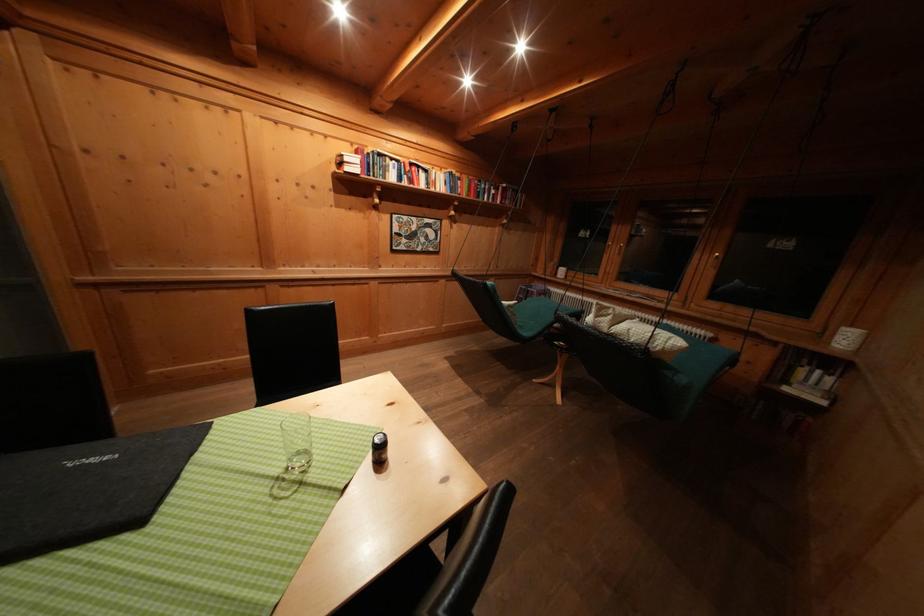
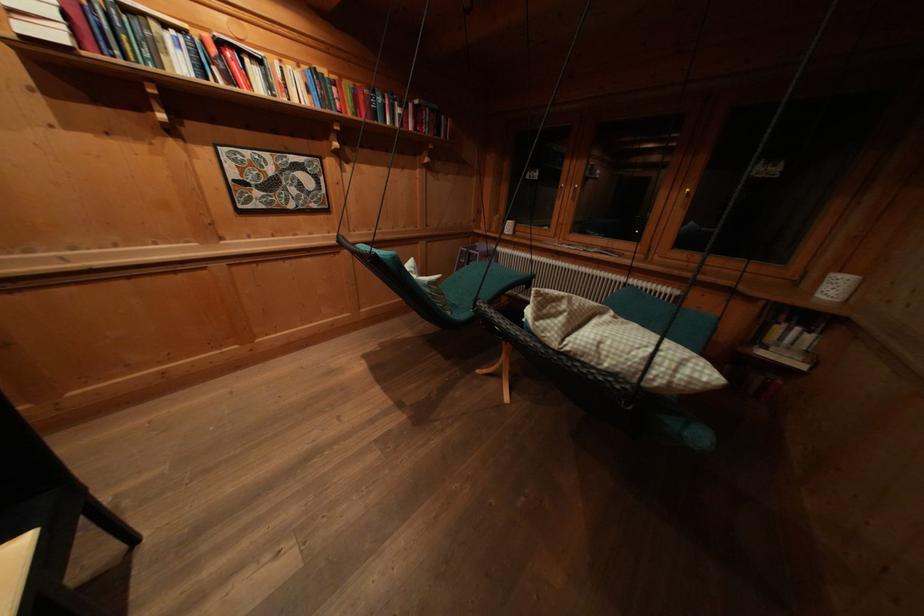
Locate, in the second image, the point that corresponds to [520,309] in the first image.

(444, 285)